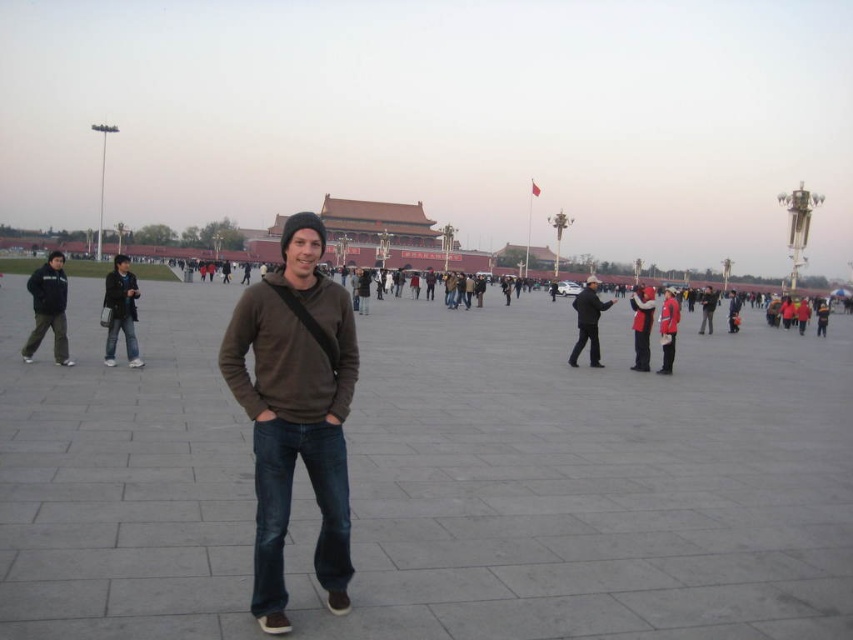
Question: Which of the following is the closest to the observer?

Choices:
 (A) reddish-brown stone palace at center
 (B) red fabric jacket at center

Answer: (A)

Question: Where is reddish-brown stone palace at center located in relation to dark gray fleece jacket at left in the image?

Choices:
 (A) left
 (B) right

Answer: (B)

Question: Among these objects, which one is nearest to the camera?

Choices:
 (A) gray concrete plaza at center
 (B) reddish-brown stone palace at center
 (C) red jacket at center

Answer: (A)

Question: Is brown cotton sweater at center bigger than red fabric jacket at center?

Choices:
 (A) no
 (B) yes

Answer: (A)

Question: Considering the relative positions of reddish-brown stone palace at center and red jacket at center in the image provided, where is reddish-brown stone palace at center located with respect to red jacket at center?

Choices:
 (A) above
 (B) below

Answer: (A)

Question: Among these points, which one is nearest to the camera?

Choices:
 (A) (178, 449)
 (B) (668, 288)

Answer: (A)